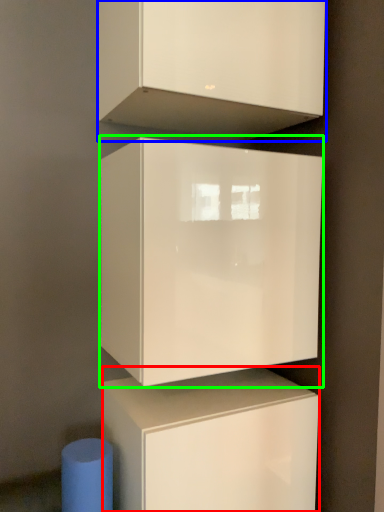
Question: Which object is the farthest from cabinetry (highlighted by a red box)? Choose among these: cabinetry (highlighted by a blue box) or cabinetry (highlighted by a green box).

Choices:
 (A) cabinetry
 (B) cabinetry

Answer: (A)